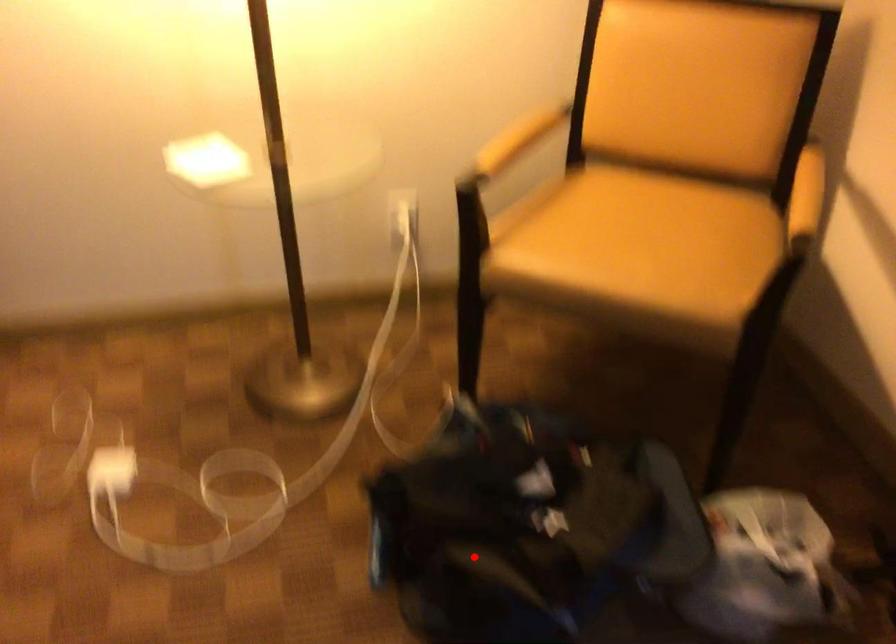
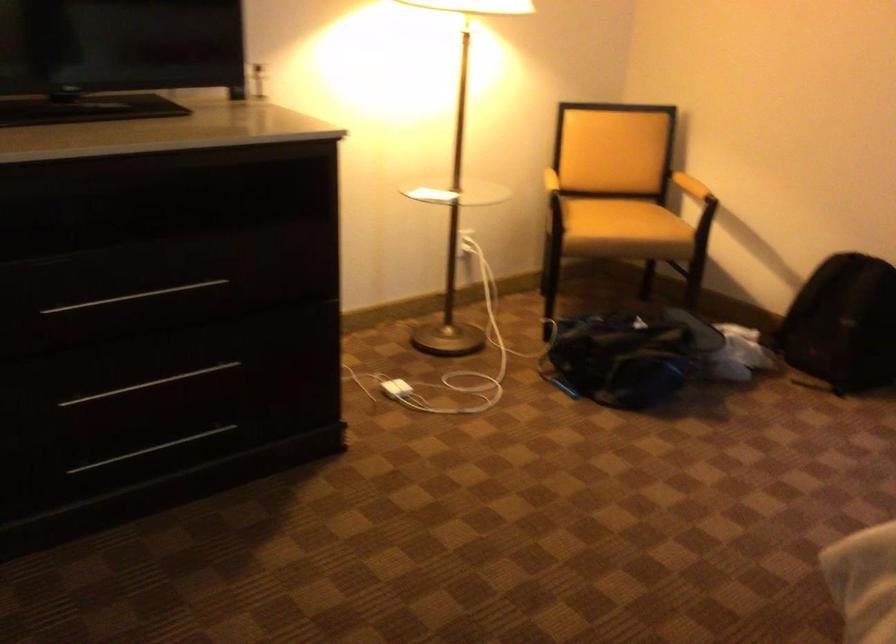
Question: I am providing you with two images of the same scene from different viewpoints. Given a red point in image1, look at the same physical point in image2. Is it:

Choices:
 (A) Closer to the viewpoint
 (B) Farther from the viewpoint

Answer: (B)